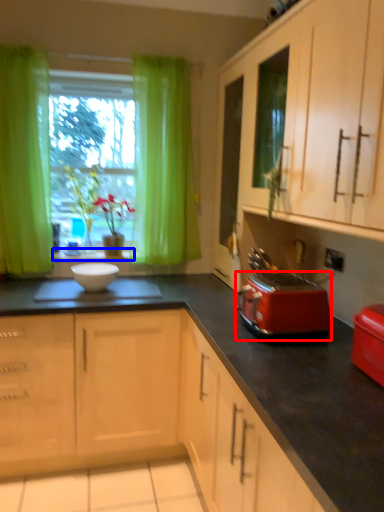
Question: Which object is closer to the camera taking this photo, kitchen appliance (highlighted by a red box) or window sill (highlighted by a blue box)?

Choices:
 (A) kitchen appliance
 (B) window sill

Answer: (A)